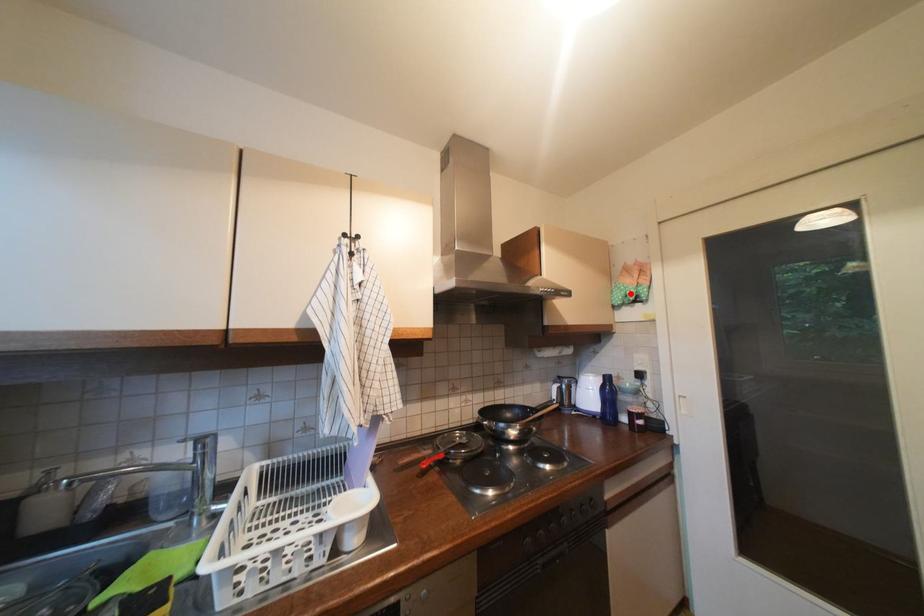
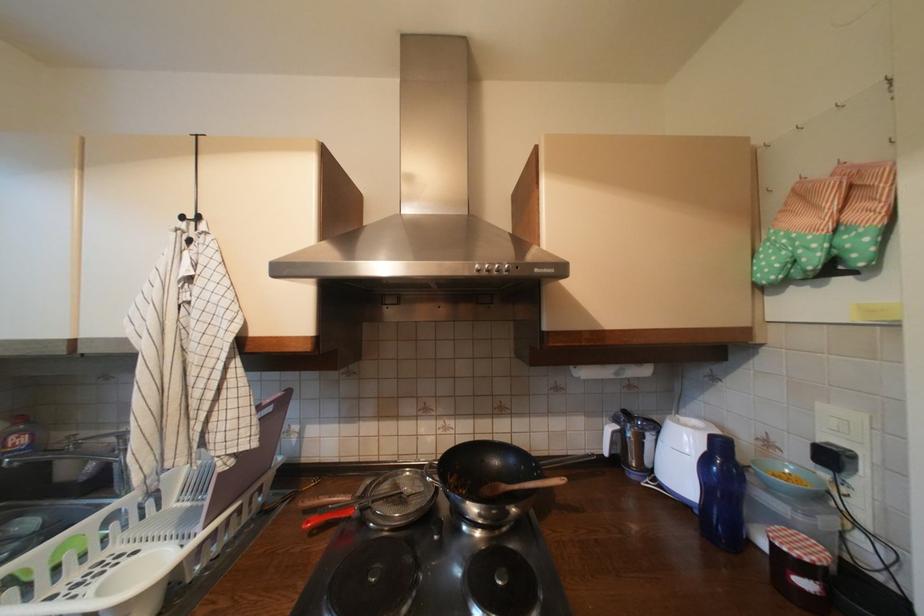
Where in the second image is the point corresponding to the highlighted location from the first image?

(793, 254)